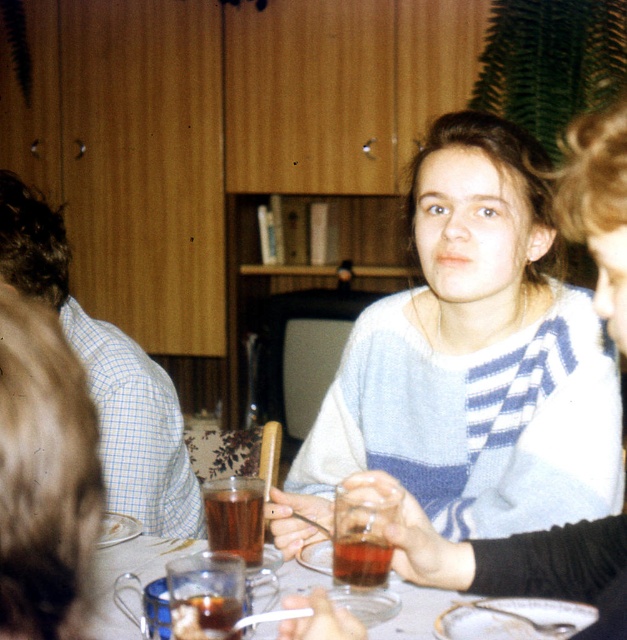
Can you confirm if brown liquid at center is taller than translucent glass at center?

Yes.

How far apart are brown liquid at center and translucent glass at center?

5.23 inches

This screenshot has width=627, height=640. I want to click on brown liquid at center, so click(234, 516).

You are a GUI agent. You are given a task and a screenshot of the screen. Output one action in this format:
    pyautogui.click(x=<x>, y=<y>)
    Task: Click on the brown liquid at center
    
    Given the screenshot: What is the action you would take?
    pyautogui.click(x=234, y=516)

The height and width of the screenshot is (640, 627). What do you see at coordinates (470, 362) in the screenshot?
I see `white knit sweater at center` at bounding box center [470, 362].

Does point (347, 388) lie behind point (134, 477)?

No, it is not.

Is point (493, 509) closer to camera compared to point (140, 420)?

Yes.

Locate an element on the screen. white knit sweater at center is located at coordinates (470, 362).

Does translucent glass tea cup at center come in front of brown liquid at center?

That is True.

Is translucent glass tea cup at center shorter than brown liquid at center?

Yes.

Is point (97, 588) positioned after point (255, 540)?

No.

This screenshot has height=640, width=627. I want to click on translucent glass tea cup at center, so click(132, 572).